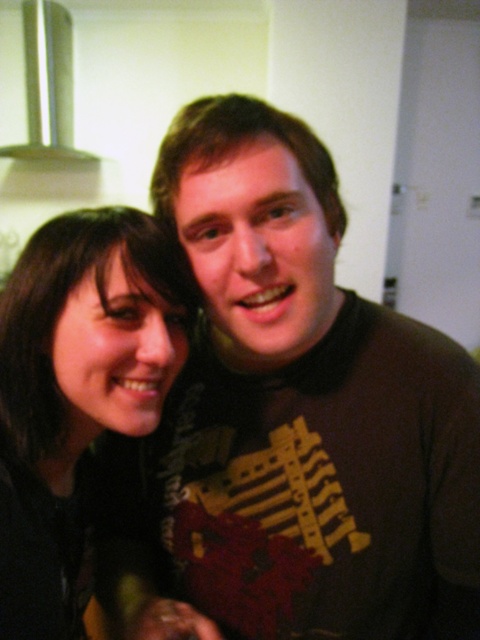
You are trying to decide whether to place a decorative plate between the black matte hair at left and the silver metallic exhaust hood at upper left. Based on their widths, will the plate fit if it is 15 cm wide?

The black matte hair at left has a lesser width compared to the silver metallic exhaust hood at upper left. Since the plate is 15 cm wide, it depends on the actual widths of both objects. However, since the exhaust hood is wider, there might be enough space between them to fit the plate.

You are taking a photo of two points in a kitchen scene. The first point is at coordinates point (76, 252) and the second point is at point (48, 157). Which point is closer to the camera?

Point (76, 252) is closer to the camera than point (48, 157).